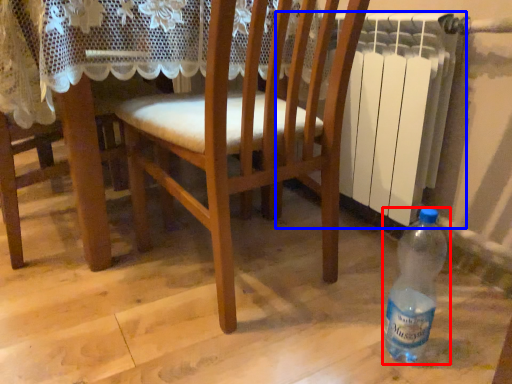
Question: Among these objects, which one is farthest to the camera, bottle (highlighted by a red box) or radiator (highlighted by a blue box)?

Choices:
 (A) bottle
 (B) radiator

Answer: (B)